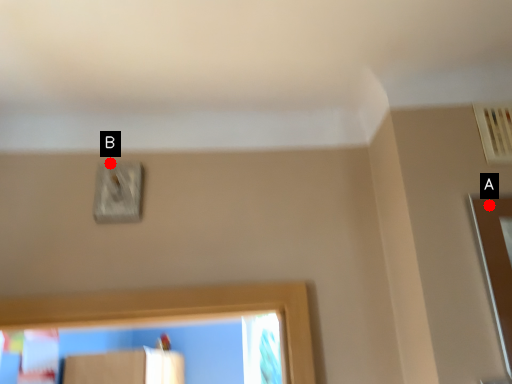
Question: Two points are circled on the image, labeled by A and B beside each circle. Among these points, which one is farthest from the camera?

Choices:
 (A) A is further
 (B) B is further

Answer: (B)